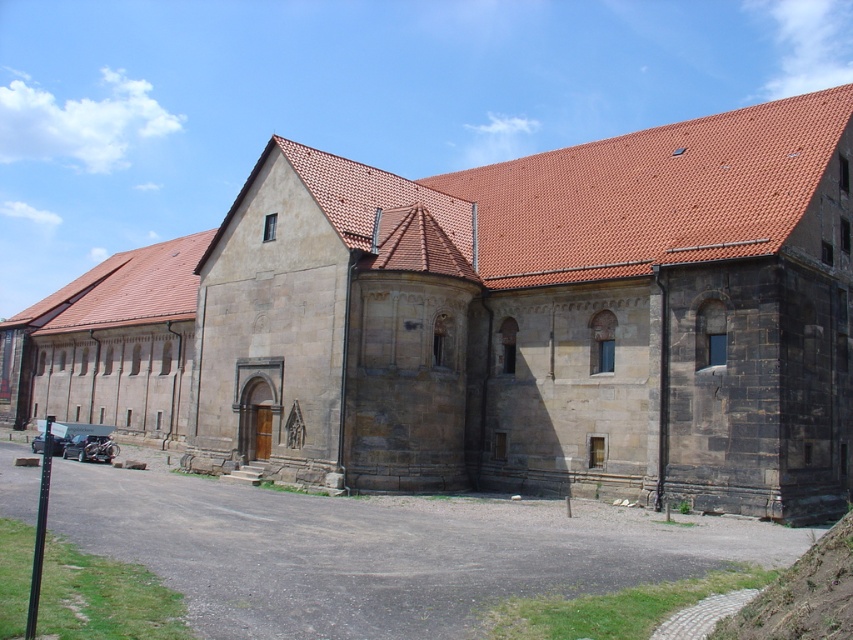
Can you confirm if stone chapel at center is positioned to the right of green grassy hill at lower right?

No, stone chapel at center is not to the right of green grassy hill at lower right.

Does point (631, 275) come closer to viewer compared to point (805, 595)?

No.

Identify the location of stone chapel at center. This screenshot has height=640, width=853. (494, 323).

Locate an element on the screen. The width and height of the screenshot is (853, 640). stone chapel at center is located at coordinates (494, 323).